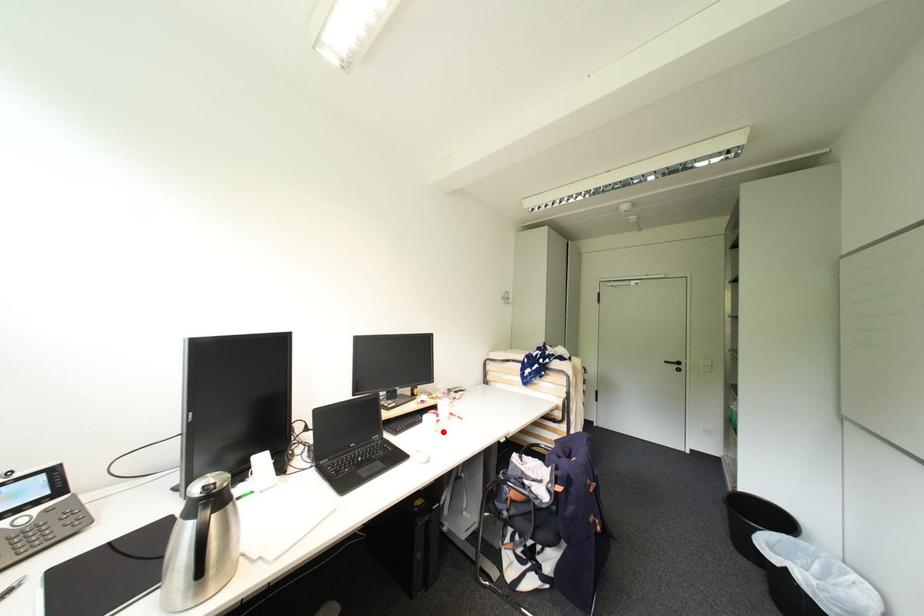
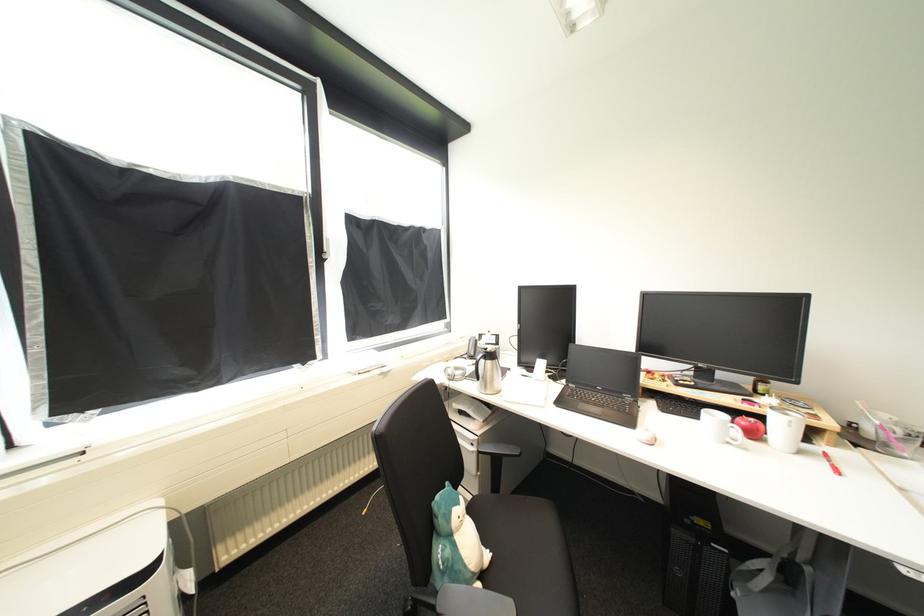
The point at the highlighted location is marked in the first image. Where is the corresponding point in the second image?

(736, 445)